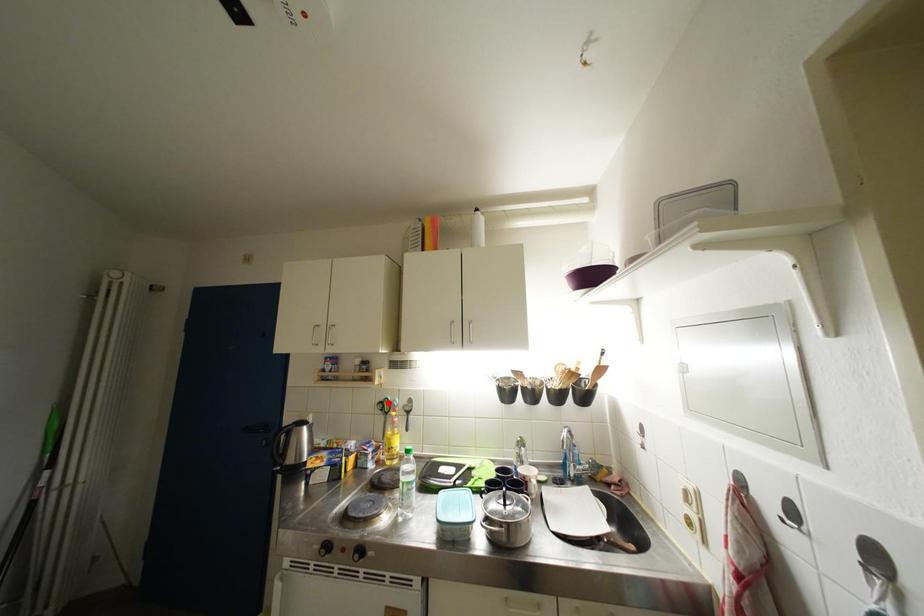
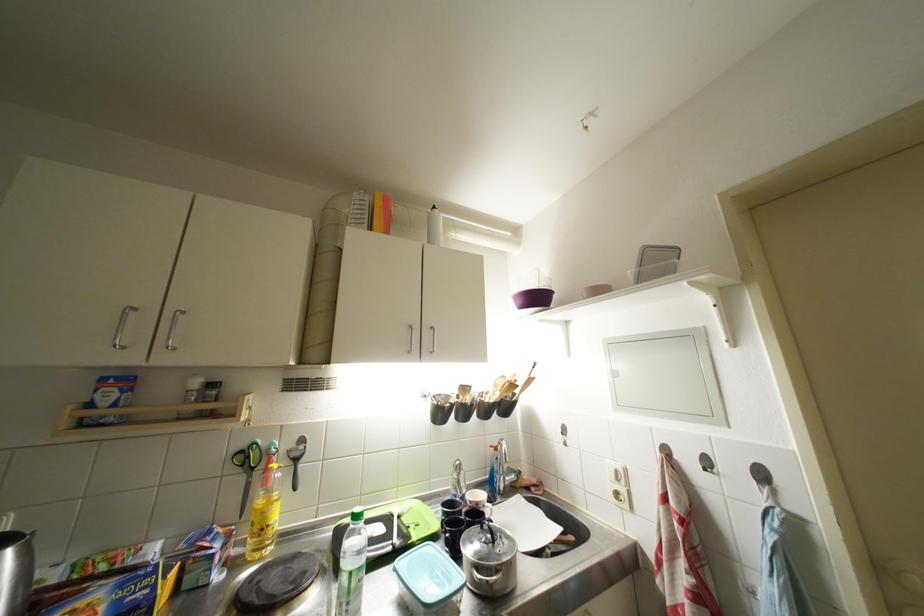
Question: I am providing you with two images of the same scene from different viewpoints. In image1, a red point is highlighted. Considering the same 3D point in image2, which of the following is correct?

Choices:
 (A) It is closer
 (B) It is farther

Answer: (A)